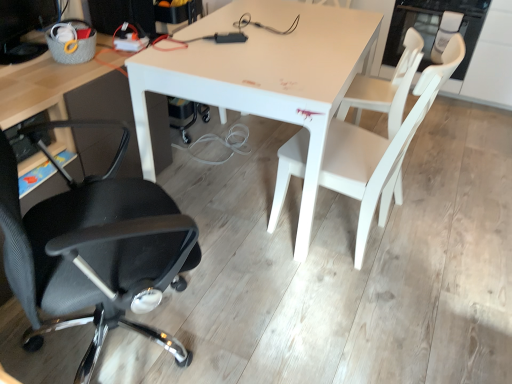
You are a GUI agent. You are given a task and a screenshot of the screen. Output one action in this format:
    pyautogui.click(x=<x>, y=<y>)
    Task: Click on the vacant space underneath black mesh office chair at left, which is counted as the 3th chair, starting from the right (from a real-world perspective)
    The image size is (512, 384).
    Given the screenshot: What is the action you would take?
    pyautogui.click(x=124, y=342)